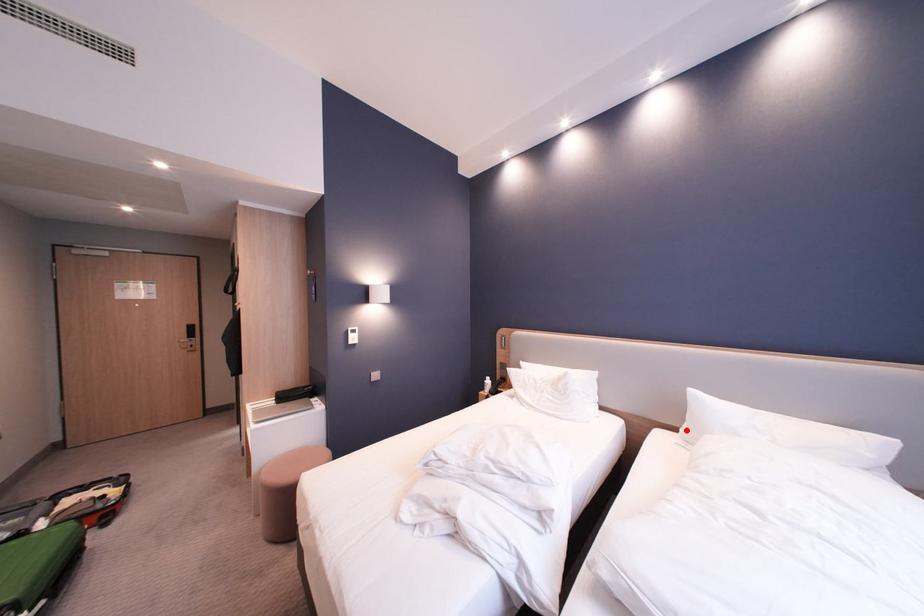
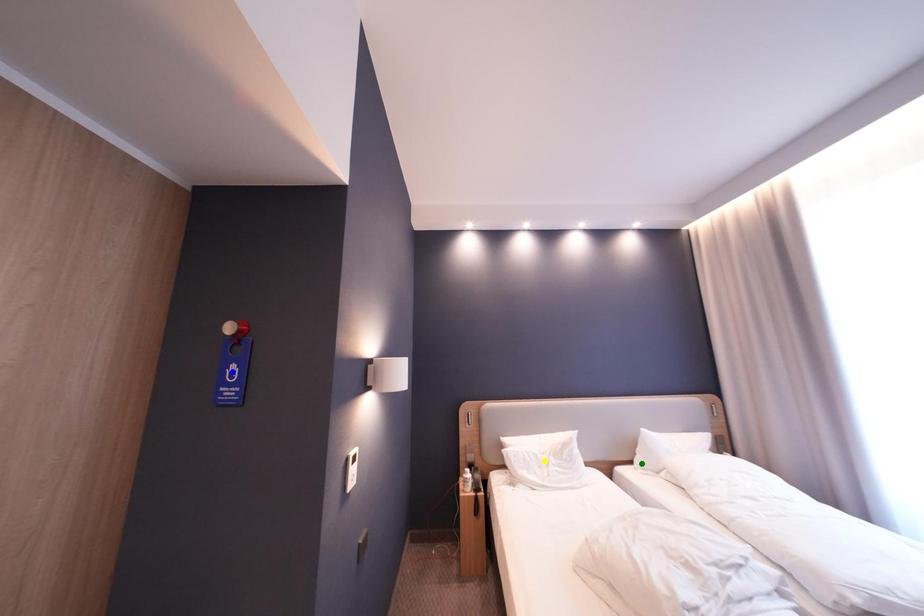
Question: I am providing you with two images of the same scene from different viewpoints. A red point is marked on the first image. You are given multiple points on the second image. Can you choose the point in image 2 that corresponds to the point in image 1?

Choices:
 (A) blue point
 (B) green point
 (C) yellow point

Answer: (B)